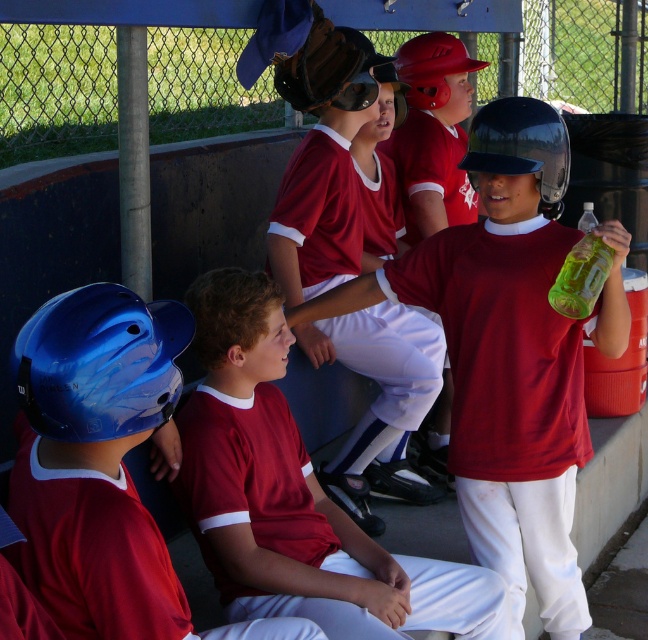
You are a photographer trying to capture a clear shot of the maroon jersey at center and the matte blue helmet at center. Since you want both subjects to be in focus, you need to adjust your camera settings based on their sizes. Which object should you focus on first to ensure proper depth of field?

The maroon jersey at center is much taller than the matte blue helmet at center, so you should focus on the maroon jersey at center first to ensure proper depth of field.

You are standing at the point marked as point (233, 468) in the dugout. You want to take a photo of the entire dugout area. The camera you have can capture a maximum distance of 3 meters. Will you be able to capture the entire dugout in one shot?

The distance between point (233, 468) and the camera is 3.24 meters, which exceeds the camera maximum distance of 3 meters. Therefore, you will not be able to capture the entire dugout in one shot.

You are standing at the point labeled point (268, 417) in the dugout. You want to throw a baseball to your teammate who is standing 3 meters away from you. Can you reach them without moving from your spot?

The distance between you and the camera is 3.49 meters, so you can throw the baseball 3 meters to reach your teammate without moving from your current position at point (268, 417).